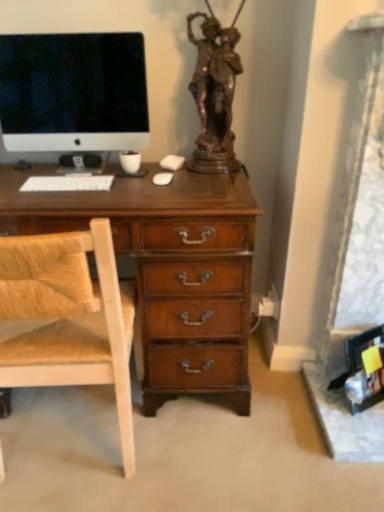
This screenshot has height=512, width=384. I want to click on white matte keyboard at center, so click(x=67, y=183).

Describe the element at coordinates (67, 318) in the screenshot. I see `light brown wood chair at left` at that location.

Image resolution: width=384 pixels, height=512 pixels. I want to click on bronze statue at upper center, so click(x=215, y=93).

Measure the distance from light brown wood chair at left to white matte keyboard at center.

A distance of 17.44 inches exists between light brown wood chair at left and white matte keyboard at center.

Is light brown wood chair at left facing away from white matte keyboard at center?

No, light brown wood chair at left's orientation is not away from white matte keyboard at center.

Which point is more forward, (48, 353) or (92, 187)?

The point (48, 353) is in front.

From a real-world perspective, is light brown wood chair at left located beneath white matte keyboard at center?

Correct, in the physical world, light brown wood chair at left is lower than white matte keyboard at center.

Is white matte keyboard at center facing towards bronze statue at upper center?

No, white matte keyboard at center is not oriented towards bronze statue at upper center.

From the image's perspective, which is above, white matte keyboard at center or bronze statue at upper center?

bronze statue at upper center, from the image's perspective.

Find the location of `computer keyboard located below the bronze statue at upper center (from the image's perspective)`. computer keyboard located below the bronze statue at upper center (from the image's perspective) is located at coordinates (67, 183).

Is white matte keyboard at center far from bronze statue at upper center?

No, white matte keyboard at center is not far away from bronze statue at upper center.

In the scene shown: Is bronze statue at upper center bigger than light brown wood chair at left?

Actually, bronze statue at upper center might be smaller than light brown wood chair at left.

From a real-world perspective, who is located lower, bronze statue at upper center or light brown wood chair at left?

light brown wood chair at left, from a real-world perspective.

Can you confirm if bronze statue at upper center is positioned to the left of light brown wood chair at left?

No.

You are a GUI agent. You are given a task and a screenshot of the screen. Output one action in this format:
    pyautogui.click(x=<x>, y=<y>)
    Task: Click on the computer monitor on the left of white matte keyboard at center
    The width and height of the screenshot is (384, 512).
    Given the screenshot: What is the action you would take?
    pyautogui.click(x=73, y=92)

From the image's perspective, who appears lower, white matte keyboard at center or white glossy computer monitor at upper left?

From the image's view, white matte keyboard at center is below.

Based on the photo, does white matte keyboard at center have a lesser width compared to white glossy computer monitor at upper left?

No.

Between bronze statue at upper center and white matte keyboard at center, which one has less height?

Standing shorter between the two is white matte keyboard at center.

Is bronze statue at upper center touching white matte keyboard at center?

No, bronze statue at upper center is not beside white matte keyboard at center.

How many degrees apart are the facing directions of bronze statue at upper center and white matte keyboard at center?

1.66 degrees separate the facing orientations of bronze statue at upper center and white matte keyboard at center.

Could you tell me if bronze statue at upper center is turned towards white matte keyboard at center?

No, bronze statue at upper center is not oriented towards white matte keyboard at center.

Is light brown wood chair at left turned away from bronze statue at upper center?

No, light brown wood chair at left is not facing away from bronze statue at upper center.

From the image's perspective, which is above, light brown wood chair at left or bronze statue at upper center?

bronze statue at upper center.

Considering the relative sizes of light brown wood chair at left and bronze statue at upper center in the image provided, is light brown wood chair at left smaller than bronze statue at upper center?

Actually, light brown wood chair at left might be larger than bronze statue at upper center.

Is light brown wood chair at left not within bronze statue at upper center?

Yes, light brown wood chair at left is not within bronze statue at upper center.

Based on the photo, how much distance is there between bronze statue at upper center and white glossy computer monitor at upper left?

They are 14.27 inches apart.

From the image's perspective, between bronze statue at upper center and white glossy computer monitor at upper left, which one is located above?

bronze statue at upper center, from the image's perspective.

Is bronze statue at upper center facing away from white glossy computer monitor at upper left?

That's not correct — bronze statue at upper center is not looking away from white glossy computer monitor at upper left.

At what (x,y) coordinates should I click in order to perform the action: click on sculpture above the white glossy computer monitor at upper left (from the image's perspective). Please return your answer as a coordinate pair (x, y). Looking at the image, I should click on (215, 93).

The image size is (384, 512). I want to click on chair lying in front of the white matte keyboard at center, so click(67, 318).

Identify the location of computer keyboard located behind the bronze statue at upper center. (67, 183).

Looking at the image, which one is located further to light brown wood chair at left, white glossy computer monitor at upper left or white matte keyboard at center?

Among the two, white glossy computer monitor at upper left is located further to light brown wood chair at left.

Which object lies nearer to the anchor point bronze statue at upper center, light brown wood chair at left or white glossy computer monitor at upper left?

white glossy computer monitor at upper left.

When comparing their distances from light brown wood chair at left, does bronze statue at upper center or white matte keyboard at center seem further?

bronze statue at upper center lies further to light brown wood chair at left than the other object.

Based on their spatial positions, is light brown wood chair at left or white matte keyboard at center further from bronze statue at upper center?

The object further to bronze statue at upper center is light brown wood chair at left.

Looking at the image, which one is located further to bronze statue at upper center, white glossy computer monitor at upper left or light brown wood chair at left?

Answer: light brown wood chair at left is positioned further to the anchor bronze statue at upper center.

From the image, which object appears to be farther from bronze statue at upper center, white matte keyboard at center or light brown wood chair at left?

light brown wood chair at left is positioned further to the anchor bronze statue at upper center.

Based on their spatial positions, is light brown wood chair at left or white matte keyboard at center closer to white glossy computer monitor at upper left?

white matte keyboard at center lies closer to white glossy computer monitor at upper left than the other object.

When comparing their distances from white matte keyboard at center, does white glossy computer monitor at upper left or light brown wood chair at left seem further?

Based on the image, light brown wood chair at left appears to be further to white matte keyboard at center.

What are the coordinates of `computer monitor between bronze statue at upper center and light brown wood chair at left in the vertical direction` in the screenshot? It's located at (73, 92).

This screenshot has height=512, width=384. I want to click on computer keyboard between white glossy computer monitor at upper left and bronze statue at upper center, so click(x=67, y=183).

Identify the location of computer keyboard between white glossy computer monitor at upper left and light brown wood chair at left vertically. The image size is (384, 512). (67, 183).

What are the coordinates of `computer keyboard between bronze statue at upper center and light brown wood chair at left in the up-down direction` in the screenshot? It's located at (67, 183).